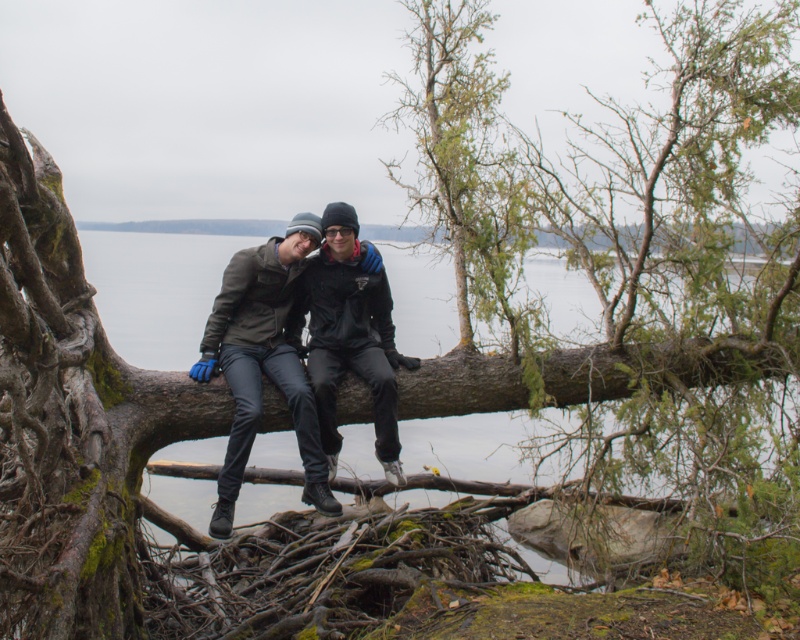
You are a photographer trying to capture a portrait of both individuals wearing the dark gray leather jacket at center and the black matte jacket at center. Since you want to frame them in a way that highlights their positions relative to each other, which jacket is positioned to the left of the other?

The dark gray leather jacket at center is to the left of the black matte jacket at center.

You are a photographer trying to capture a portrait of both individuals sitting on the green rough bark tree at center. Since the black matte jacket at center is in the foreground, will it block the view of the tree in your photo?

The green rough bark tree at center is much taller than the black matte jacket at center, so the tree will be visible behind the jacket in the photo.